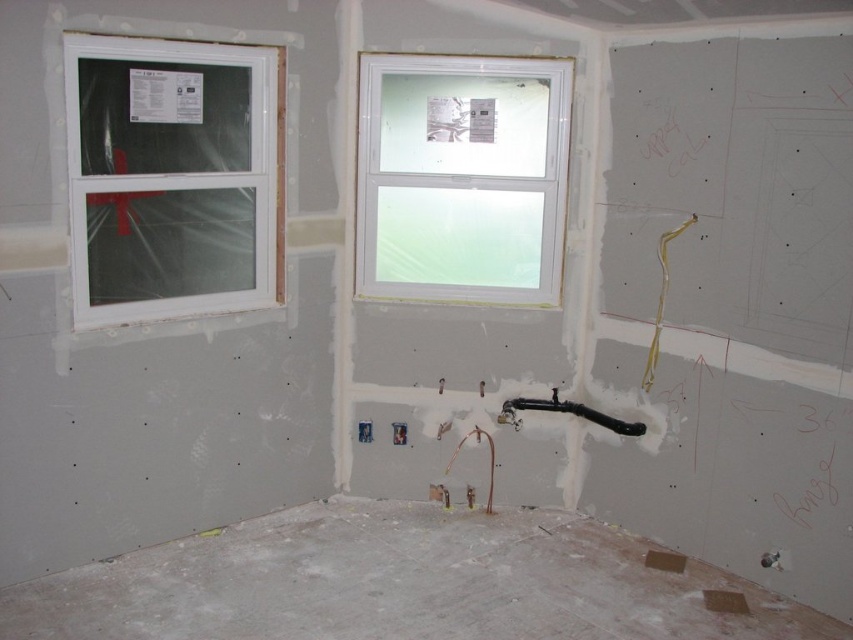
Question: Can you confirm if white plastic window at left is positioned to the left of black rubber pipe at center?

Choices:
 (A) yes
 (B) no

Answer: (A)

Question: Estimate the real-world distances between objects in this image. Which object is closer to the black rubber pipe at center?

Choices:
 (A) white plastic window at upper center
 (B) white plastic window at left

Answer: (A)

Question: Can you confirm if white plastic window at upper center is positioned to the right of black rubber pipe at center?

Choices:
 (A) no
 (B) yes

Answer: (A)

Question: Considering the real-world distances, which object is closest to the white plastic window at upper center?

Choices:
 (A) white plastic window at left
 (B) black rubber pipe at center

Answer: (A)

Question: Which point is closer to the camera?

Choices:
 (A) (421, 241)
 (B) (227, 216)

Answer: (B)

Question: Does white plastic window at left lie behind white plastic window at upper center?

Choices:
 (A) yes
 (B) no

Answer: (B)